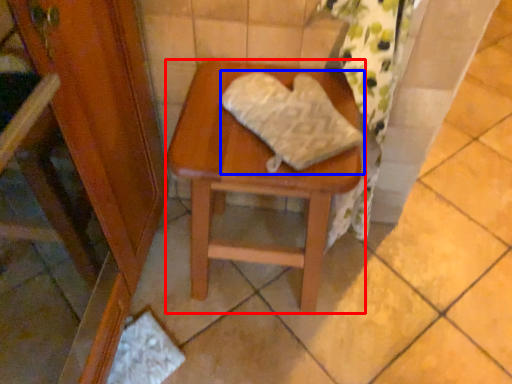
Question: Which object appears closest to the camera in this image, stool (highlighted by a red box) or material (highlighted by a blue box)?

Choices:
 (A) stool
 (B) material

Answer: (B)